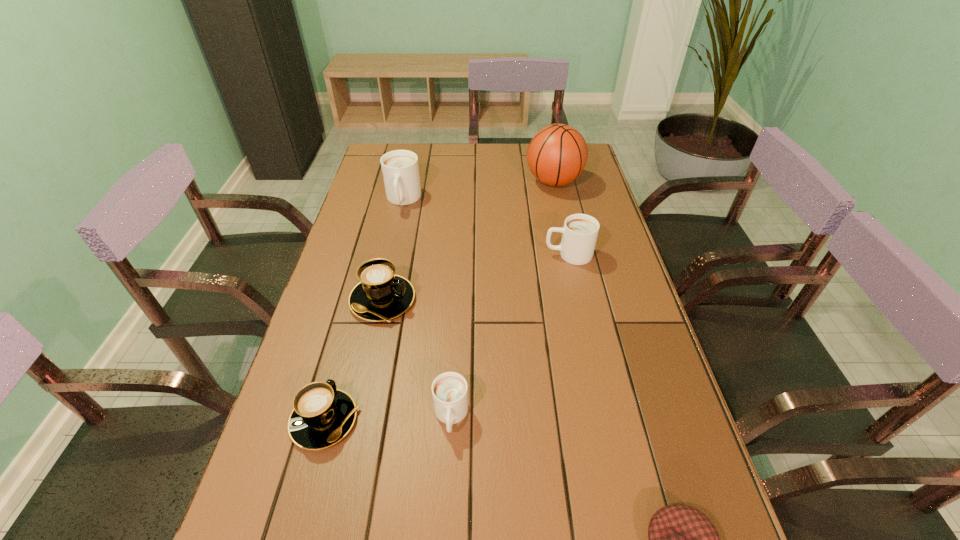
Identify the location of basketball. The height and width of the screenshot is (540, 960). (557, 154).

Locate an element on the screen. the biggest white cappuccino is located at coordinates (400, 169).

The image size is (960, 540). What are the coordinates of `the farthest white cappuccino` in the screenshot? It's located at [x=400, y=169].

The width and height of the screenshot is (960, 540). Find the location of `the second smallest white cappuccino`. the second smallest white cappuccino is located at coordinates (580, 231).

Where is `the second nearest white cappuccino`? This screenshot has width=960, height=540. the second nearest white cappuccino is located at coordinates (580, 231).

In order to click on the third farthest cappuccino in this screenshot , I will do coord(381,295).

Find the location of a particular element. Image resolution: width=960 pixels, height=540 pixels. the farther black cappuccino is located at coordinates (381, 295).

The width and height of the screenshot is (960, 540). In order to click on the second white cappuccino from left to right in this screenshot , I will do [449, 390].

Find the location of a particular element. This screenshot has height=540, width=960. the smallest white cappuccino is located at coordinates (449, 390).

Image resolution: width=960 pixels, height=540 pixels. In order to click on the smaller black cappuccino in this screenshot , I will do `click(322, 415)`.